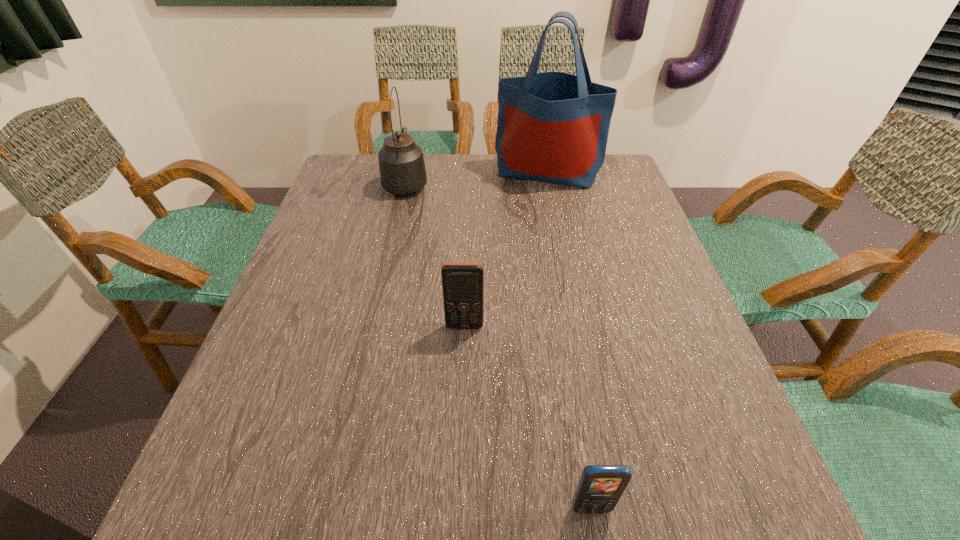
What are the coordinates of `handbag that is at the far edge` in the screenshot? It's located at (552, 127).

The height and width of the screenshot is (540, 960). I want to click on kettle that is at the far edge, so click(402, 169).

You are a GUI agent. You are given a task and a screenshot of the screen. Output one action in this format:
    pyautogui.click(x=<x>, y=<y>)
    Task: Click on the object that is at the near edge
    This screenshot has height=540, width=960.
    Given the screenshot: What is the action you would take?
    point(600,487)

Image resolution: width=960 pixels, height=540 pixels. I want to click on object present at the left edge, so click(x=402, y=169).

Where is `object that is at the right edge`? object that is at the right edge is located at coordinates (552, 127).

What are the coordinates of `object situated at the far left corner` in the screenshot? It's located at (402, 169).

The width and height of the screenshot is (960, 540). I want to click on object that is at the far right corner, so click(552, 127).

In the image, there is a desktop. Identify the location of blank space at the far edge. The width and height of the screenshot is (960, 540). pyautogui.click(x=522, y=191).

Locate an element on the screen. vacant space at the near edge of the desktop is located at coordinates (470, 500).

Locate an element on the screen. The width and height of the screenshot is (960, 540). free space at the left edge of the desktop is located at coordinates (351, 198).